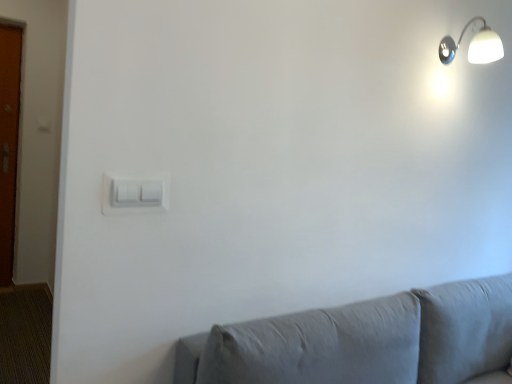
Where is `white plastic light switch at center`? white plastic light switch at center is located at coordinates (135, 194).

What do you see at coordinates (135, 194) in the screenshot?
I see `white plastic light switch at center` at bounding box center [135, 194].

This screenshot has height=384, width=512. In order to click on white glossy wall lamp at upper right in this screenshot , I will do `click(474, 46)`.

What do you see at coordinates (474, 46) in the screenshot? I see `white glossy wall lamp at upper right` at bounding box center [474, 46].

At what (x,y) coordinates should I click in order to perform the action: click on white plastic light switch at center. Please return your answer as a coordinate pair (x, y). The height and width of the screenshot is (384, 512). Looking at the image, I should click on (135, 194).

Considering the relative positions of white plastic light switch at center and white glossy wall lamp at upper right in the image provided, is white plastic light switch at center to the left of white glossy wall lamp at upper right from the viewer's perspective?

Indeed, white plastic light switch at center is positioned on the left side of white glossy wall lamp at upper right.

Is white plastic light switch at center positioned before white glossy wall lamp at upper right?

Yes, the depth of white plastic light switch at center is less than that of white glossy wall lamp at upper right.

Is point (106, 189) in front of point (482, 31)?

Yes, point (106, 189) is closer to viewer.

From the image's perspective, which one is positioned lower, white plastic light switch at center or white glossy wall lamp at upper right?

white plastic light switch at center is shown below in the image.

From a real-world perspective, which object stands above the other?

From a 3D spatial view, white glossy wall lamp at upper right is above.

Which object is thinner, white plastic light switch at center or white glossy wall lamp at upper right?

white plastic light switch at center.

Is white plastic light switch at center shorter than white glossy wall lamp at upper right?

Correct, white plastic light switch at center is not as tall as white glossy wall lamp at upper right.

Between white plastic light switch at center and white glossy wall lamp at upper right, which one has smaller size?

white plastic light switch at center.

Is white plastic light switch at center not inside white glossy wall lamp at upper right?

Yes, white plastic light switch at center is outside of white glossy wall lamp at upper right.

Is white plastic light switch at center far away from white glossy wall lamp at upper right?

white plastic light switch at center is far away from white glossy wall lamp at upper right.

Is white plastic light switch at center positioned with its back to white glossy wall lamp at upper right?

white plastic light switch at center is not turned away from white glossy wall lamp at upper right.

The width and height of the screenshot is (512, 384). I want to click on light switch on the left of white glossy wall lamp at upper right, so click(x=135, y=194).

Which object is positioned more to the left, white glossy wall lamp at upper right or white plastic light switch at center?

white plastic light switch at center.

Is white glossy wall lamp at upper right positioned before white plastic light switch at center?

No, it is not.

Which is behind, point (478, 39) or point (133, 207)?

The point (478, 39) is behind.

From the image's perspective, is white glossy wall lamp at upper right located above white plastic light switch at center?

Yes, from the image's perspective, white glossy wall lamp at upper right is above white plastic light switch at center.

From a real-world perspective, relative to white plastic light switch at center, is white glossy wall lamp at upper right vertically above or below?

In terms of real-world spatial position, white glossy wall lamp at upper right is above white plastic light switch at center.

Is white glossy wall lamp at upper right wider or thinner than white plastic light switch at center?

In the image, white glossy wall lamp at upper right appears to be wider than white plastic light switch at center.

In the scene shown: Considering the relative sizes of white glossy wall lamp at upper right and white plastic light switch at center in the image provided, is white glossy wall lamp at upper right taller than white plastic light switch at center?

Yes.

Between white glossy wall lamp at upper right and white plastic light switch at center, which one has smaller size?

→ Smaller between the two is white plastic light switch at center.

Is white glossy wall lamp at upper right not inside white plastic light switch at center?

white glossy wall lamp at upper right is positioned outside white plastic light switch at center.

Are white glossy wall lamp at upper right and white plastic light switch at center beside each other?

No, white glossy wall lamp at upper right is not with white plastic light switch at center.

Could you tell me if white glossy wall lamp at upper right is turned towards white plastic light switch at center?

No, white glossy wall lamp at upper right is not turned towards white plastic light switch at center.

How different are the orientations of white glossy wall lamp at upper right and white plastic light switch at center in degrees?

There is a 0.302-degree angle between the facing directions of white glossy wall lamp at upper right and white plastic light switch at center.

Locate an element on the screen. This screenshot has width=512, height=384. light switch beneath the white glossy wall lamp at upper right (from a real-world perspective) is located at coordinates (135, 194).

Image resolution: width=512 pixels, height=384 pixels. Find the location of `lamp on the right of the white plastic light switch at center`. lamp on the right of the white plastic light switch at center is located at coordinates (474, 46).

The image size is (512, 384). Find the location of `light switch that appears on the left of white glossy wall lamp at upper right`. light switch that appears on the left of white glossy wall lamp at upper right is located at coordinates (135, 194).